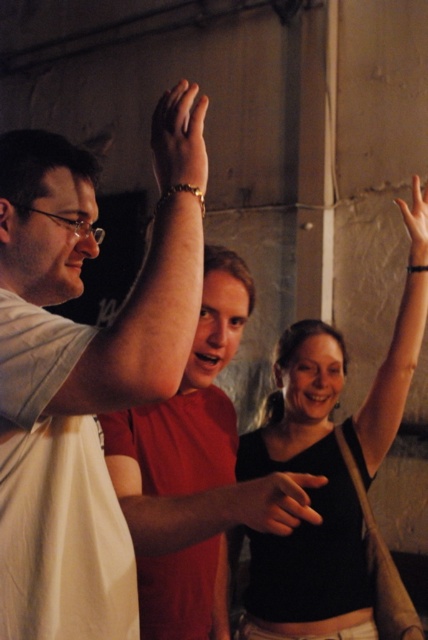
Question: Does white matte shirt at upper left appear under matte white arm at center?

Choices:
 (A) no
 (B) yes

Answer: (A)

Question: Is black matte arm at upper right thinner than smooth skin hand at upper right?

Choices:
 (A) yes
 (B) no

Answer: (B)

Question: Which object appears farthest from the camera in this image?

Choices:
 (A) smooth skin hand at upper right
 (B) white matte shirt at upper left
 (C) matte white shirt at center

Answer: (A)

Question: Does black fabric tank top at upper right appear on the right side of matte white arm at center?

Choices:
 (A) yes
 (B) no

Answer: (A)

Question: Which object appears farthest from the camera in this image?

Choices:
 (A) black fabric tank top at upper right
 (B) matte gold bracelet at upper center

Answer: (A)

Question: Which of the following is the closest to the observer?

Choices:
 (A) (288, 545)
 (B) (419, 180)
 (C) (0, 609)

Answer: (C)